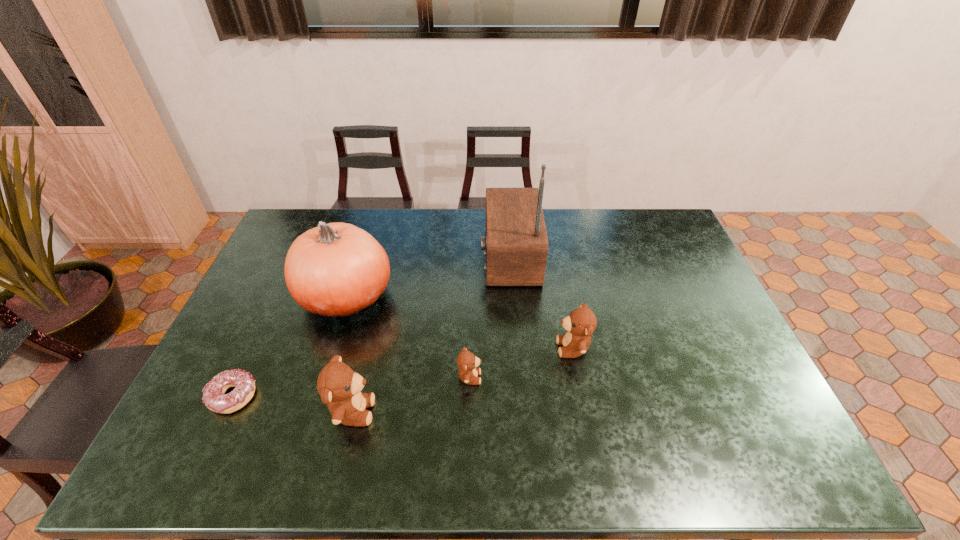
Find the location of a particular element. vacant area situated 0.180m on the face of the fourth tallest object is located at coordinates (492, 348).

Find the location of `vacant space located 0.330m on the face of the fourth tallest object`. vacant space located 0.330m on the face of the fourth tallest object is located at coordinates (440, 348).

This screenshot has width=960, height=540. In order to click on free space located on the face of the fourth tallest object in this screenshot , I will do `click(436, 348)`.

Locate an element on the screen. vacant area situated 0.230m on the front-facing side of the tallest object is located at coordinates (415, 256).

Identify the location of free location located on the front-facing side of the tallest object. This screenshot has width=960, height=540. (372, 256).

I want to click on free spot located 0.280m on the front-facing side of the tallest object, so click(x=401, y=256).

Where is `free space located on the back of the pumpkin`? The height and width of the screenshot is (540, 960). free space located on the back of the pumpkin is located at coordinates (363, 244).

Locate an element on the screen. The image size is (960, 540). free space located on the back of the shortest object is located at coordinates (251, 359).

This screenshot has height=540, width=960. In order to click on object located in the far edge section of the desktop in this screenshot , I will do `click(516, 244)`.

Locate an element on the screen. teddy bear present at the near edge is located at coordinates (339, 386).